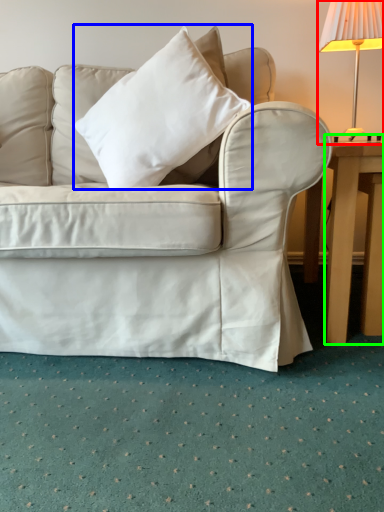
Question: Considering the real-world distances, which object is closest to lamp (highlighted by a red box)? pillow (highlighted by a blue box) or table (highlighted by a green box).

Choices:
 (A) pillow
 (B) table

Answer: (B)